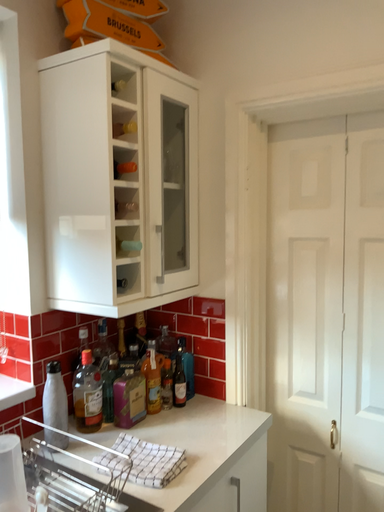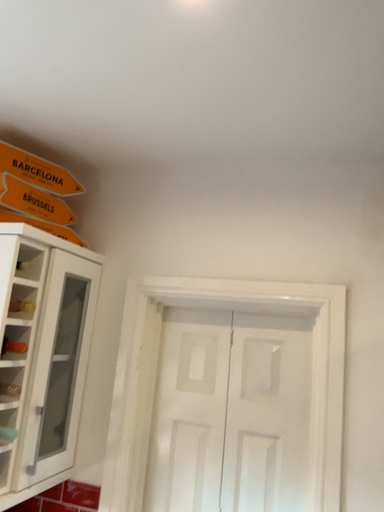
Question: Which way did the camera rotate in the video?

Choices:
 (A) rotated downward
 (B) rotated upward

Answer: (B)